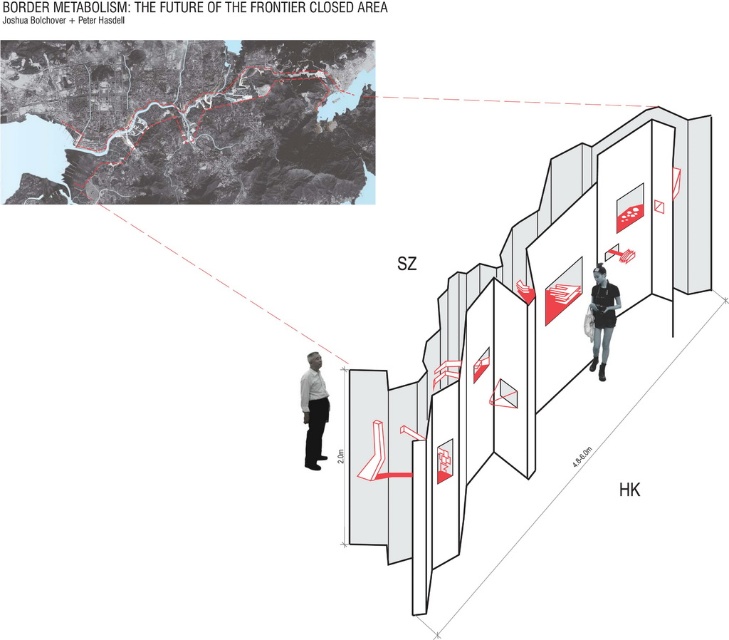
Does white matte shirt at lower left appear on the left side of black matte shirt at center?

Correct, you'll find white matte shirt at lower left to the left of black matte shirt at center.

Between point (311, 356) and point (590, 368), which one is positioned behind?

Positioned behind is point (311, 356).

Find the location of a particular element. white matte shirt at lower left is located at coordinates [x=313, y=410].

Find the location of a particular element. The height and width of the screenshot is (640, 729). white matte shirt at lower left is located at coordinates (313, 410).